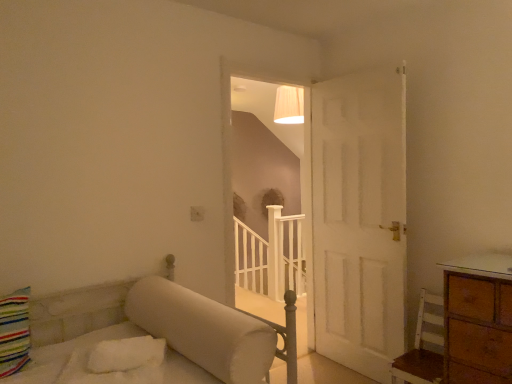
Question: Is white wooden balustrade at center next to white wood chair at lower right?

Choices:
 (A) no
 (B) yes

Answer: (A)

Question: Can you confirm if white wooden balustrade at center is shorter than white wood chair at lower right?

Choices:
 (A) yes
 (B) no

Answer: (B)

Question: Is white wooden balustrade at center positioned with its back to white wood chair at lower right?

Choices:
 (A) no
 (B) yes

Answer: (A)

Question: Does white wooden balustrade at center have a greater height compared to white wood chair at lower right?

Choices:
 (A) no
 (B) yes

Answer: (B)

Question: Does white wooden balustrade at center have a greater width compared to white wood chair at lower right?

Choices:
 (A) no
 (B) yes

Answer: (A)

Question: From a real-world perspective, is white wood chair at lower right physically located above or below white wooden balustrade at center?

Choices:
 (A) below
 (B) above

Answer: (B)

Question: Is white wood chair at lower right spatially inside white wooden balustrade at center, or outside of it?

Choices:
 (A) inside
 (B) outside

Answer: (B)

Question: Looking at their shapes, would you say white wood chair at lower right is wider or thinner than white wooden balustrade at center?

Choices:
 (A) thin
 (B) wide

Answer: (B)

Question: Is white wood chair at lower right in front of or behind white wooden balustrade at center in the image?

Choices:
 (A) front
 (B) behind

Answer: (A)

Question: Is white wooden balustrade at center wider or thinner than white wood chair at lower right?

Choices:
 (A) thin
 (B) wide

Answer: (A)

Question: Do you think white wooden balustrade at center is within white wood chair at lower right, or outside of it?

Choices:
 (A) inside
 (B) outside

Answer: (B)

Question: Is white wooden balustrade at center in front of or behind white wood chair at lower right in the image?

Choices:
 (A) front
 (B) behind

Answer: (B)

Question: Is point (x=236, y=274) positioned closer to the camera than point (x=395, y=367)?

Choices:
 (A) farther
 (B) closer

Answer: (A)

Question: From a real-world perspective, relative to white wood chair at lower right, is white matte staircase at center vertically above or below?

Choices:
 (A) above
 (B) below

Answer: (A)

Question: Is white matte staircase at center inside the boundaries of white wood chair at lower right, or outside?

Choices:
 (A) outside
 (B) inside

Answer: (A)